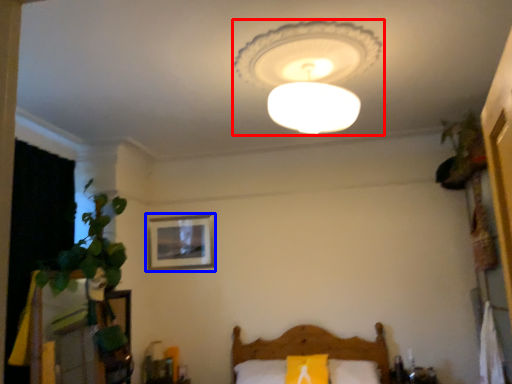
Question: Which object appears closest to the camera in this image, lamp (highlighted by a red box) or picture frame (highlighted by a blue box)?

Choices:
 (A) lamp
 (B) picture frame

Answer: (A)